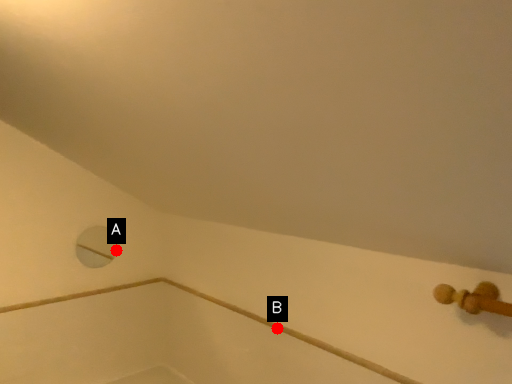
Question: Two points are circled on the image, labeled by A and B beside each circle. Which point is closer to the camera?

Choices:
 (A) A is closer
 (B) B is closer

Answer: (B)